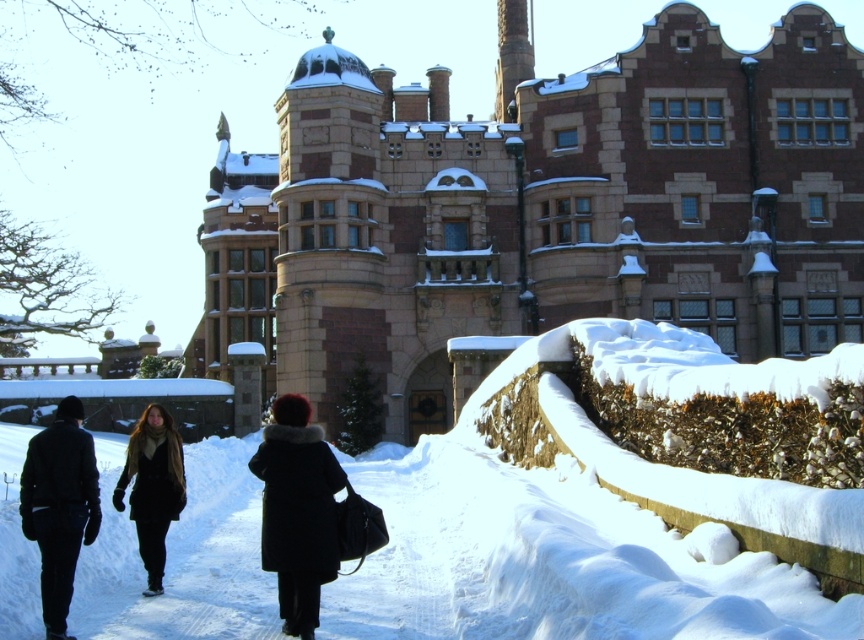
Can you confirm if dark brown leather coat at lower left is positioned below velvet black coat at center?

Yes, dark brown leather coat at lower left is below velvet black coat at center.

Does point (91, 486) lie in front of point (270, 529)?

No, it is not.

Locate an element on the screen. The height and width of the screenshot is (640, 864). dark brown leather coat at lower left is located at coordinates (59, 506).

Is point (149, 566) closer to viewer compared to point (154, 592)?

No, it is not.

Is dark brown leather coat at lower left positioned behind velvet brown coat at center?

No, it is in front of velvet brown coat at center.

Is point (140, 442) behind point (156, 404)?

No, (140, 442) is in front of (156, 404).

The height and width of the screenshot is (640, 864). I want to click on dark brown leather coat at lower left, so click(x=59, y=506).

Does velvet black coat at center have a lesser height compared to velvet brown coat at center?

No.

Is point (280, 499) farther from viewer compared to point (162, 589)?

That is False.

Identify the location of velvet black coat at center. The height and width of the screenshot is (640, 864). (297, 509).